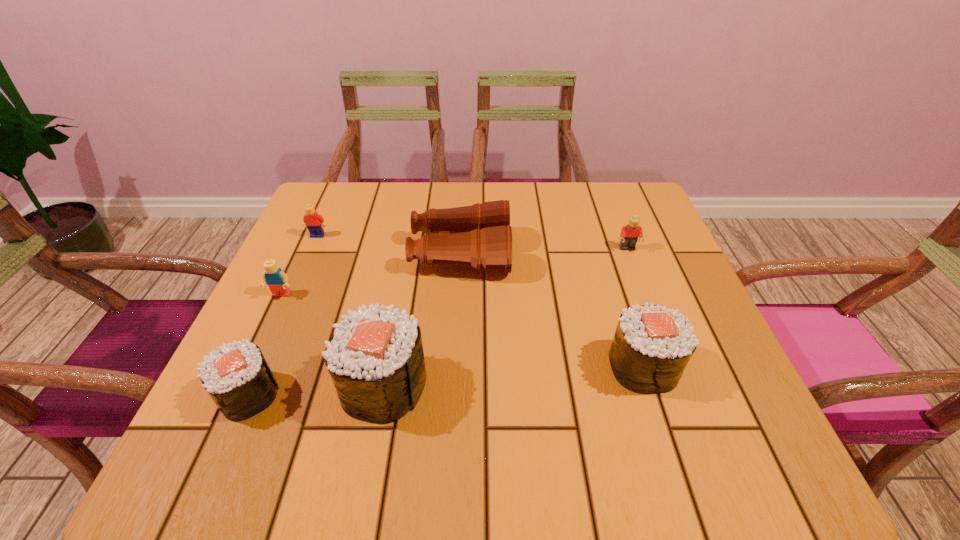
Identify the location of unoccupied position between the leftmost sushi and the second sushi from left to right. The height and width of the screenshot is (540, 960). (316, 390).

Where is `unoccupied position between the shortest sushi and the nearest Lego`? Image resolution: width=960 pixels, height=540 pixels. unoccupied position between the shortest sushi and the nearest Lego is located at coordinates (265, 345).

Locate an element on the screen. The width and height of the screenshot is (960, 540). free spot between the tallest sushi and the rightmost sushi is located at coordinates (513, 376).

Image resolution: width=960 pixels, height=540 pixels. I want to click on free space between the second nearest Lego and the nearest Lego, so click(x=454, y=272).

Find the location of `free point between the rightmost Lego and the leftmost sushi`. free point between the rightmost Lego and the leftmost sushi is located at coordinates (438, 322).

Locate an element on the screen. This screenshot has height=540, width=960. free space between the farthest Lego and the binoculars is located at coordinates (389, 245).

Find the location of a particular element. The image size is (960, 540). object that stands as the third closest to the second farthest Lego is located at coordinates (375, 358).

Identify which object is the sixth nearest to the second shortest sushi. Please provide its 2D coordinates. Your answer should be formatted as a tuple, i.e. [(x, y)], where the tuple contains the x and y coordinates of a point satisfying the conditions above.

[(315, 223)]

Locate which sushi is the second closest to the leftmost sushi. Please provide its 2D coordinates. Your answer should be formatted as a tuple, i.e. [(x, y)], where the tuple contains the x and y coordinates of a point satisfying the conditions above.

[(652, 345)]

Select which sushi is the closest to the rightmost sushi. Please provide its 2D coordinates. Your answer should be formatted as a tuple, i.e. [(x, y)], where the tuple contains the x and y coordinates of a point satisfying the conditions above.

[(375, 358)]